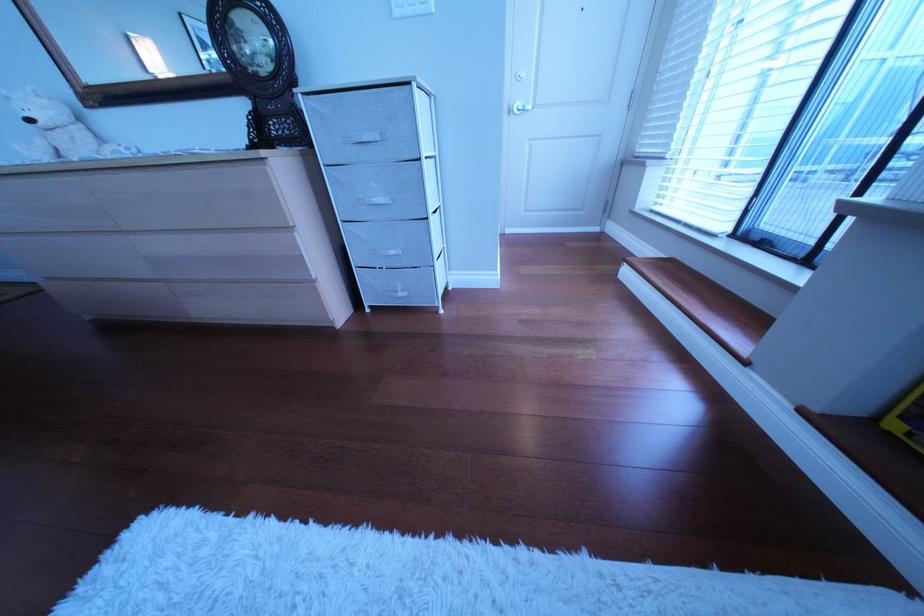
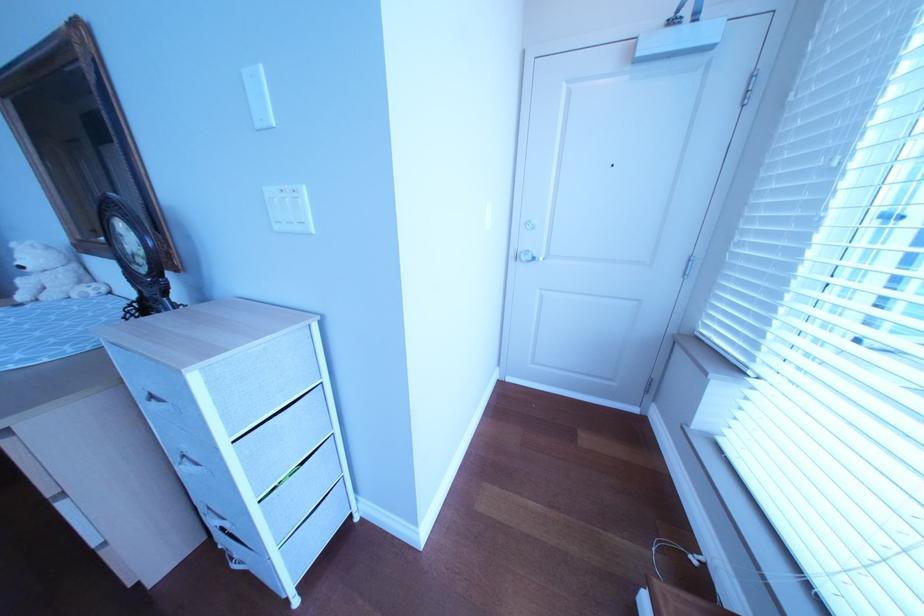
The images are taken continuously from a first-person perspective. In which direction are you moving?

The movement direction of the cameraman is right, forward.